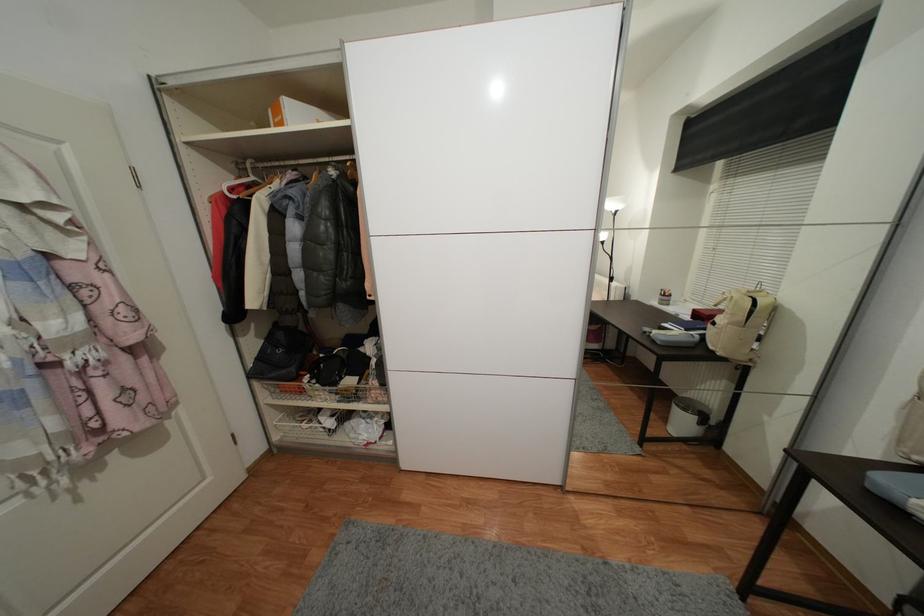
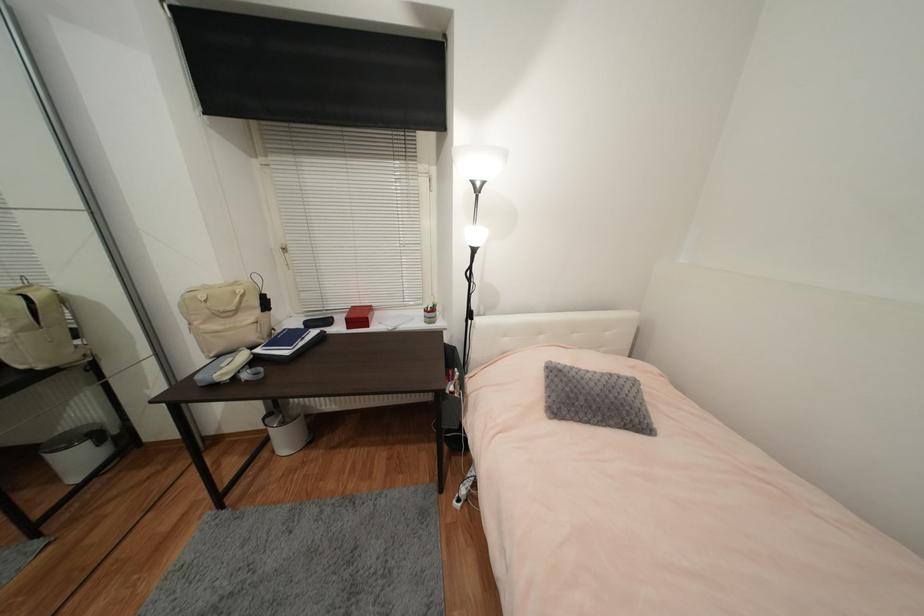
The point at (687,424) is marked in the first image. Where is the corresponding point in the second image?

(83, 462)